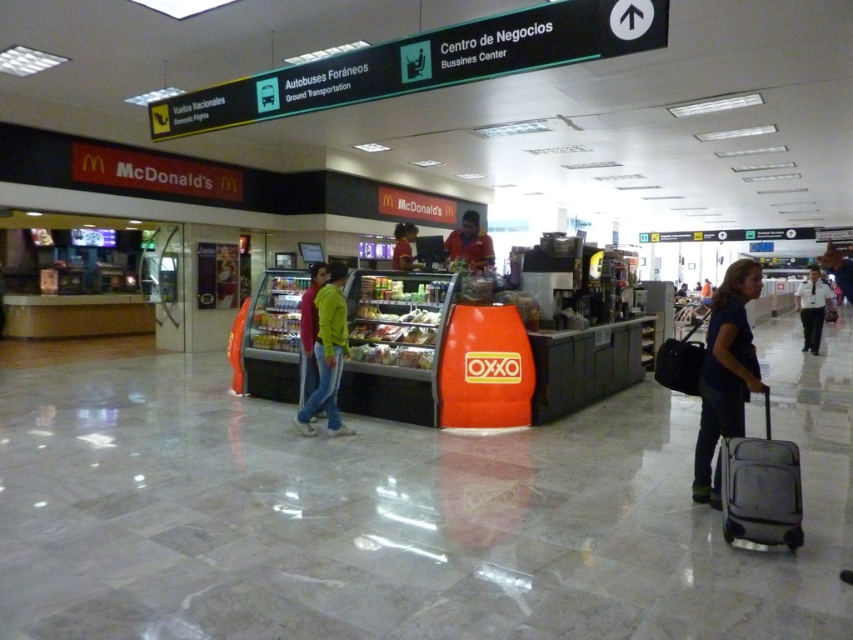
Is point (746, 332) positioned after point (805, 300)?

No.

At what (x,y) coordinates should I click in order to perform the action: click on dark blue fabric at center-right. Please return your answer as a coordinate pair (x, y). The image size is (853, 640). Looking at the image, I should click on (724, 372).

Can you confirm if gray fabric suitcase at lower right is positioned below jeans at center?

Yes, gray fabric suitcase at lower right is below jeans at center.

Is gray fabric suitcase at lower right shorter than jeans at center?

Yes, gray fabric suitcase at lower right is shorter than jeans at center.

Is point (762, 515) positioned before point (328, 280)?

Yes.

The width and height of the screenshot is (853, 640). What are the coordinates of `gray fabric suitcase at lower right` in the screenshot? It's located at (761, 488).

Can you confirm if dark blue fabric at center-right is smaller than matte yellow shirt at center?

Incorrect, dark blue fabric at center-right is not smaller in size than matte yellow shirt at center.

Measure the distance from dark blue fabric at center-right to matte yellow shirt at center.

They are 3.92 meters apart.

What do you see at coordinates (724, 372) in the screenshot? I see `dark blue fabric at center-right` at bounding box center [724, 372].

In order to click on dark blue fabric at center-right in this screenshot , I will do `click(724, 372)`.